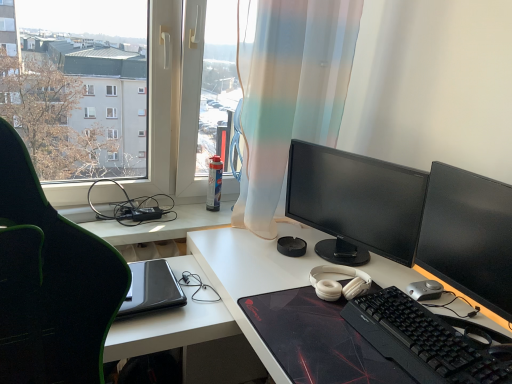
In order to click on empty space that is ontop of black textured mousepad at center in this screenshot , I will do `click(336, 332)`.